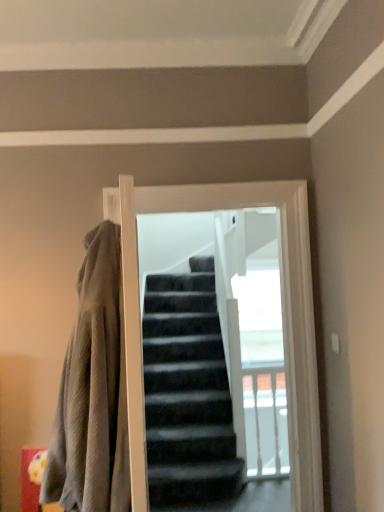
Question: Should I look upward or downward to see black matte screen door at center?

Choices:
 (A) up
 (B) down

Answer: (B)

Question: Would you say textured gray blanket at left contains black matte screen door at center?

Choices:
 (A) no
 (B) yes

Answer: (A)

Question: From the image's perspective, would you say textured gray blanket at left is shown under black matte screen door at center?

Choices:
 (A) no
 (B) yes

Answer: (B)

Question: Is textured gray blanket at left aimed at black matte screen door at center?

Choices:
 (A) no
 (B) yes

Answer: (A)

Question: Considering the relative sizes of textured gray blanket at left and black matte screen door at center in the image provided, is textured gray blanket at left smaller than black matte screen door at center?

Choices:
 (A) no
 (B) yes

Answer: (A)

Question: Is textured gray blanket at left shorter than black matte screen door at center?

Choices:
 (A) yes
 (B) no

Answer: (A)

Question: Does textured gray blanket at left have a larger size compared to black matte screen door at center?

Choices:
 (A) no
 (B) yes

Answer: (B)

Question: From a real-world perspective, is black matte screen door at center positioned under textured gray blanket at left based on gravity?

Choices:
 (A) yes
 (B) no

Answer: (B)

Question: Is black matte screen door at center positioned behind textured gray blanket at left?

Choices:
 (A) yes
 (B) no

Answer: (A)

Question: Is black matte screen door at center positioned in front of textured gray blanket at left?

Choices:
 (A) yes
 (B) no

Answer: (B)

Question: From the image's perspective, would you say black matte screen door at center is positioned over textured gray blanket at left?

Choices:
 (A) no
 (B) yes

Answer: (B)

Question: Is black matte screen door at center bigger than textured gray blanket at left?

Choices:
 (A) yes
 (B) no

Answer: (B)

Question: Is black matte screen door at center oriented towards textured gray blanket at left?

Choices:
 (A) no
 (B) yes

Answer: (A)

Question: Would you say textured gray blanket at left is inside or outside black matte screen door at center?

Choices:
 (A) inside
 (B) outside

Answer: (B)